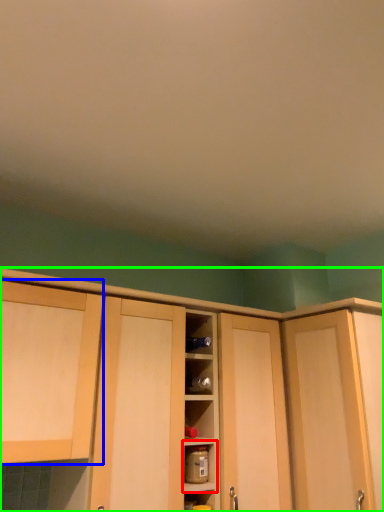
Question: Estimate the real-world distances between objects in this image. Which object is farther from shelf (highlighted by a red box), cabinetry (highlighted by a blue box) or cabinetry (highlighted by a green box)?

Choices:
 (A) cabinetry
 (B) cabinetry

Answer: (B)